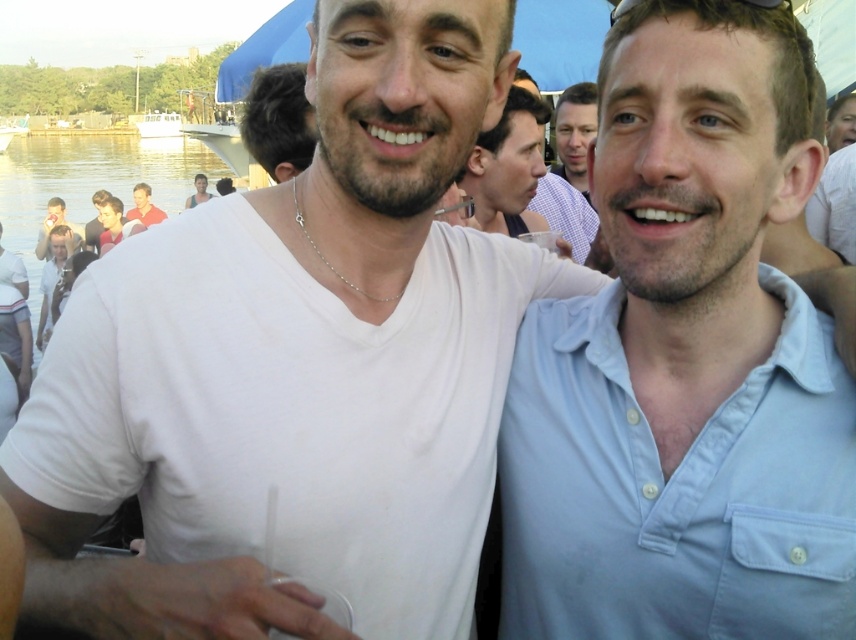
Is clear water at lower left bigger than matte white shirt at center?

Correct, clear water at lower left is larger in size than matte white shirt at center.

Does clear water at lower left have a smaller size compared to matte white shirt at center?

No.

I want to click on clear water at lower left, so click(92, 179).

Locate an element on the screen. The image size is (856, 640). clear water at lower left is located at coordinates (92, 179).

Does point (723, 624) come behind point (853, 136)?

No, it is not.

Does point (715, 636) come closer to viewer compared to point (837, 144)?

Yes, it is in front of point (837, 144).

Is point (568, 372) more distant than point (842, 106)?

No, it is in front of (842, 106).

This screenshot has width=856, height=640. Find the location of `light blue button-down shirt at center`. light blue button-down shirt at center is located at coordinates (685, 364).

Does matte white shirt at upper right have a smaller size compared to matte black tank top at center?

Yes, matte white shirt at upper right is smaller than matte black tank top at center.

Between point (842, 96) and point (192, 200), which one is positioned behind?

The point (192, 200) is more distant.

Locate an element on the screen. This screenshot has width=856, height=640. matte white shirt at upper right is located at coordinates (840, 122).